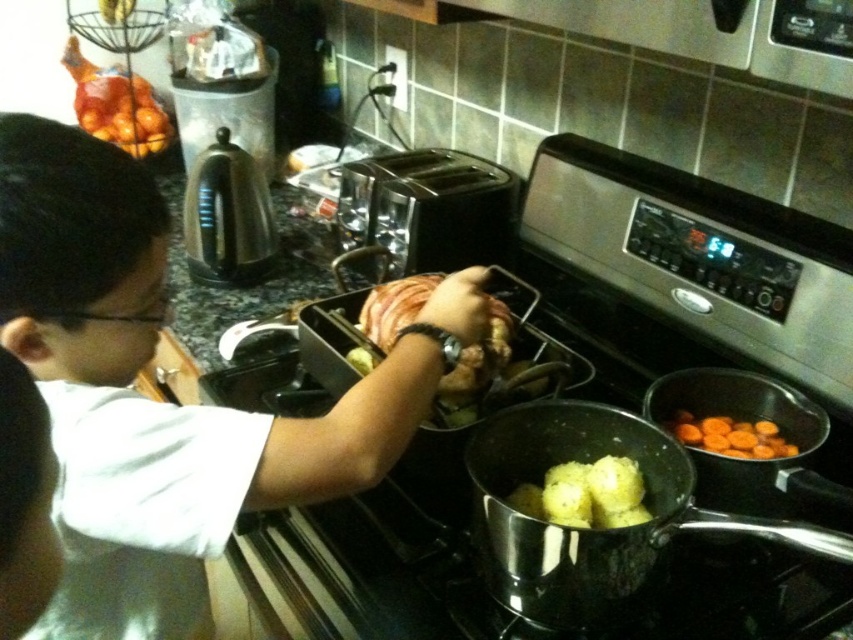
Question: Is white matte shirt at upper left wider than shiny metallic kettle at upper left?

Choices:
 (A) no
 (B) yes

Answer: (B)

Question: Does satin black toaster at center come behind shiny metallic kettle at upper left?

Choices:
 (A) no
 (B) yes

Answer: (A)

Question: Can you confirm if white matte shirt at upper left is positioned to the left of orange matte carrot at right?

Choices:
 (A) no
 (B) yes

Answer: (B)

Question: Based on their relative distances, which object is farther from the white matte shirt at upper left?

Choices:
 (A) yellow matte potatoes at center
 (B) stainless steel gas stove at center
 (C) shiny metallic kettle at upper left
 (D) shiny silver pot at lower center

Answer: (C)

Question: Based on their relative distances, which object is farther from the stainless steel gas stove at center?

Choices:
 (A) shiny metallic kettle at upper left
 (B) yellow matte potatoes at center

Answer: (A)

Question: Estimate the real-world distances between objects in this image. Which object is closer to the stainless steel gas stove at center?

Choices:
 (A) satin black toaster at center
 (B) yellow matte potatoes at center
 (C) shiny metallic kettle at upper left

Answer: (B)